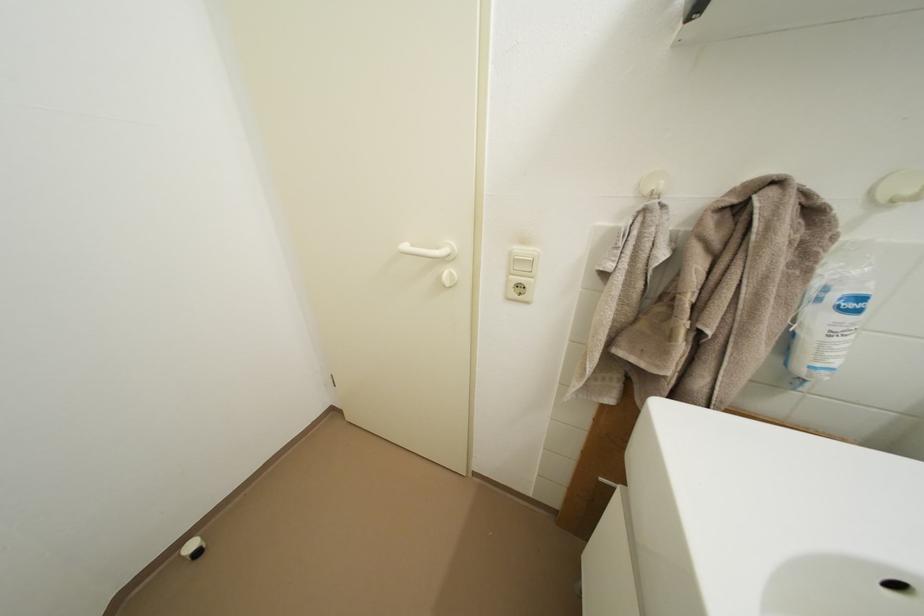
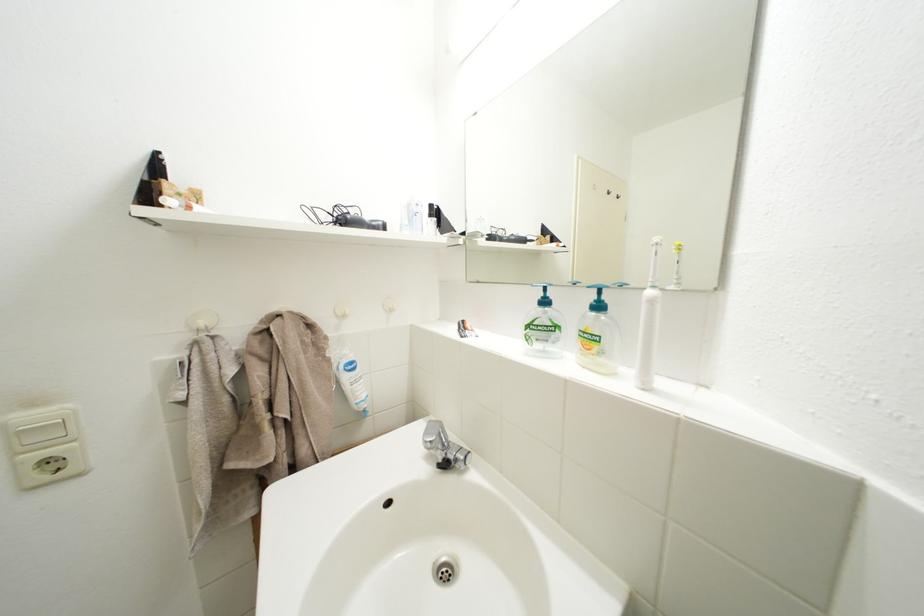
In the second image, find the point that corresponds to point (519, 259) in the first image.

(14, 432)